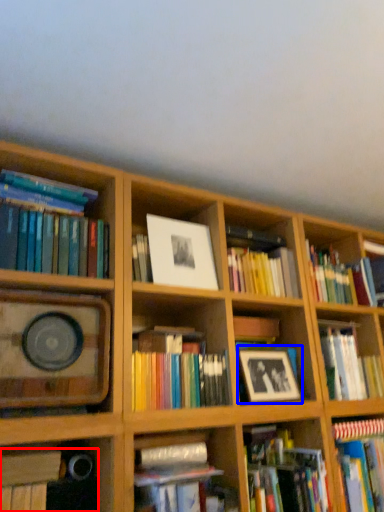
Question: Which object appears closest to the camera in this image, book (highlighted by a red box) or picture frame (highlighted by a blue box)?

Choices:
 (A) book
 (B) picture frame

Answer: (A)